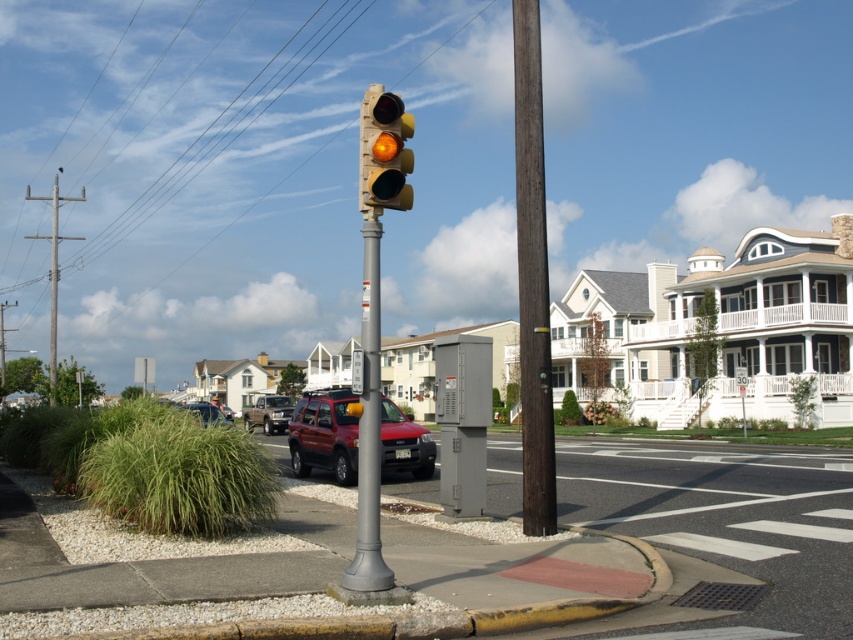
Question: Does gray metallic pole at center appear on the left side of matte yellow traffic light at center?

Choices:
 (A) no
 (B) yes

Answer: (A)

Question: Observing the image, what is the correct spatial positioning of brown wooden pole at center in reference to metallic rectangular sign at center?

Choices:
 (A) above
 (B) below

Answer: (A)

Question: Which of the following is the farthest from the observer?

Choices:
 (A) (289, 442)
 (B) (524, 448)

Answer: (A)

Question: Which of these objects is positioned farthest from the brown wooden pole at center?

Choices:
 (A) gray metallic pole at center
 (B) metallic rectangular sign at center

Answer: (A)

Question: Based on their relative distances, which object is nearer to the gray metallic pole at center?

Choices:
 (A) matte yellow traffic light at center
 (B) brown wooden pole at center
 (C) shiny red suv at center

Answer: (A)

Question: Is brown wooden pole at center wider than gray metallic pole at center?

Choices:
 (A) no
 (B) yes

Answer: (B)